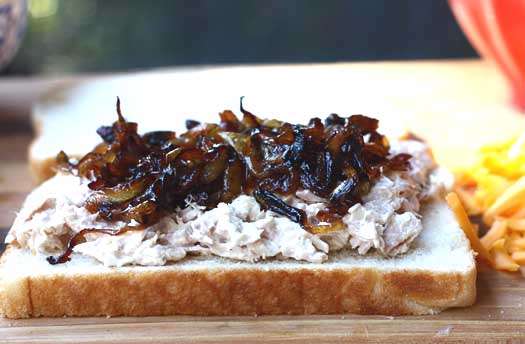
I want to click on red curtain, so click(x=504, y=28).